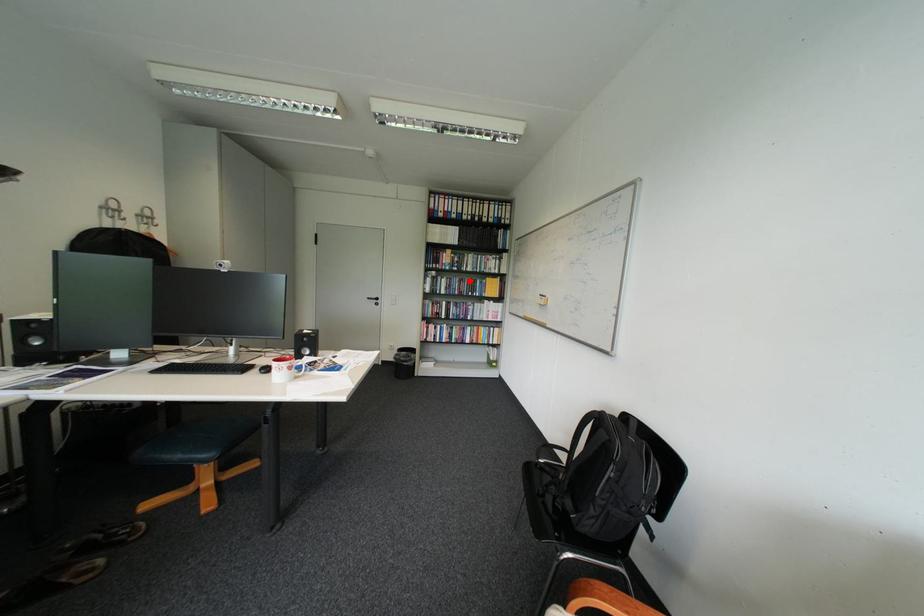
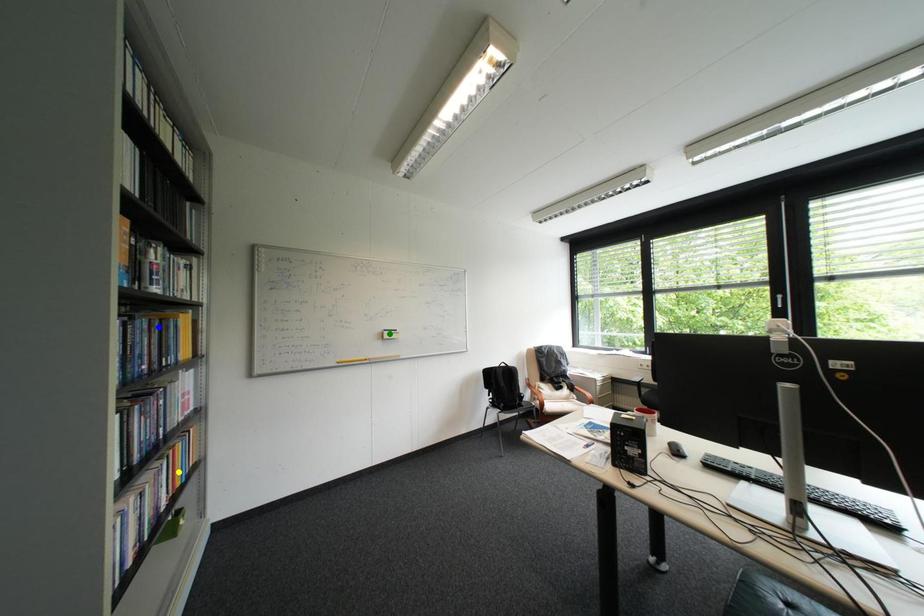
Question: I am providing you with two images of the same scene from different viewpoints. A red point is marked on the first image. You are given multiple points on the second image. In image 2, which mark is for the same physical point as the one in image 1?

Choices:
 (A) yellow point
 (B) green point
 (C) blue point

Answer: (C)